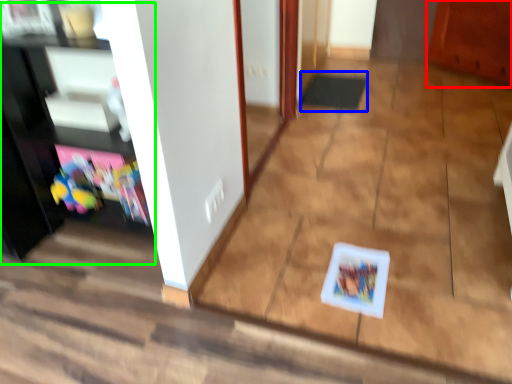
Question: Estimate the real-world distances between objects in this image. Which object is closer to cabinetry (highlighted by a red box), doormat (highlighted by a blue box) or entertainment center (highlighted by a green box)?

Choices:
 (A) doormat
 (B) entertainment center

Answer: (A)